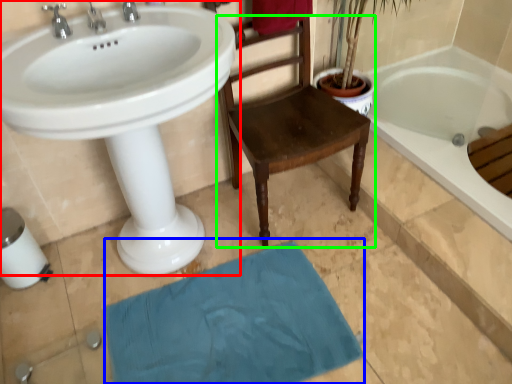
Question: Which is nearer to the sink (highlighted by a red box)? bath mat (highlighted by a blue box) or chair (highlighted by a green box).

Choices:
 (A) bath mat
 (B) chair

Answer: (B)